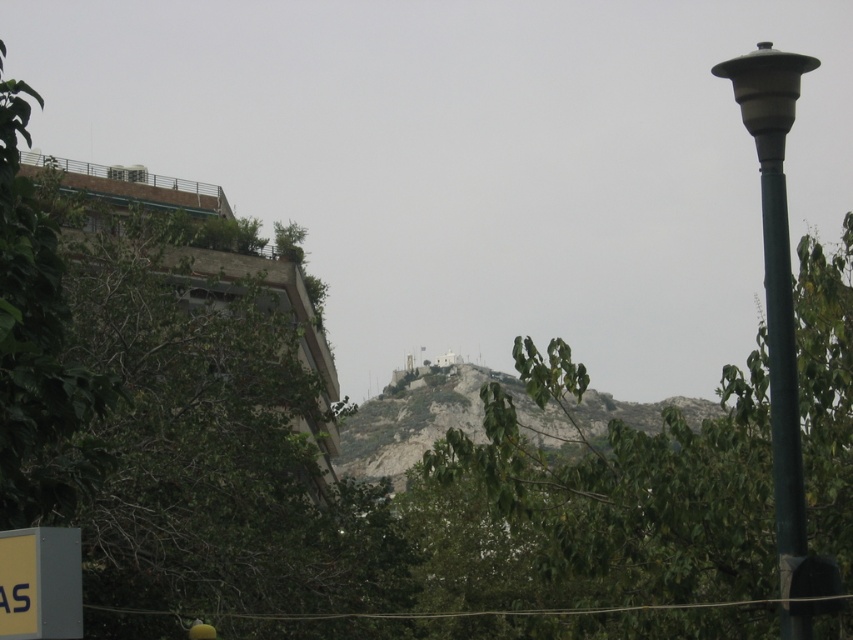
Question: Is rocky gray hillside at center positioned at the back of matte green pole at right?

Choices:
 (A) yes
 (B) no

Answer: (A)

Question: Among these objects, which one is nearest to the camera?

Choices:
 (A) gray plastic sign at lower left
 (B) matte green pole at right
 (C) green leafy tree at center

Answer: (A)

Question: Is matte green pole at right positioned in front of gray plastic sign at lower left?

Choices:
 (A) yes
 (B) no

Answer: (B)

Question: Is green leafy tree at center further to the viewer compared to green metallic pole at right?

Choices:
 (A) yes
 (B) no

Answer: (A)

Question: Which point is closer to the camera?

Choices:
 (A) green metallic pole at right
 (B) rocky gray hillside at center

Answer: (A)

Question: Which object is the farthest from the green metallic pole at right?

Choices:
 (A) green leafy tree at center
 (B) gray plastic sign at lower left

Answer: (A)